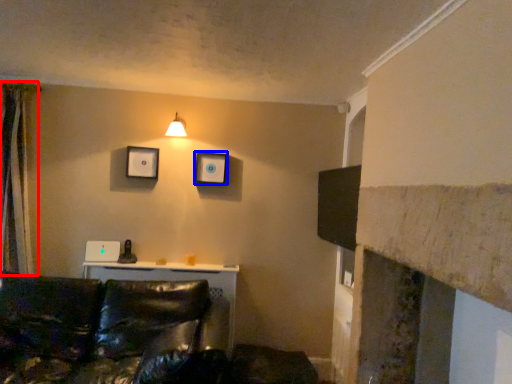
Question: Which of the following is the farthest to the observer, curtain (highlighted by a red box) or picture frame (highlighted by a blue box)?

Choices:
 (A) curtain
 (B) picture frame

Answer: (B)